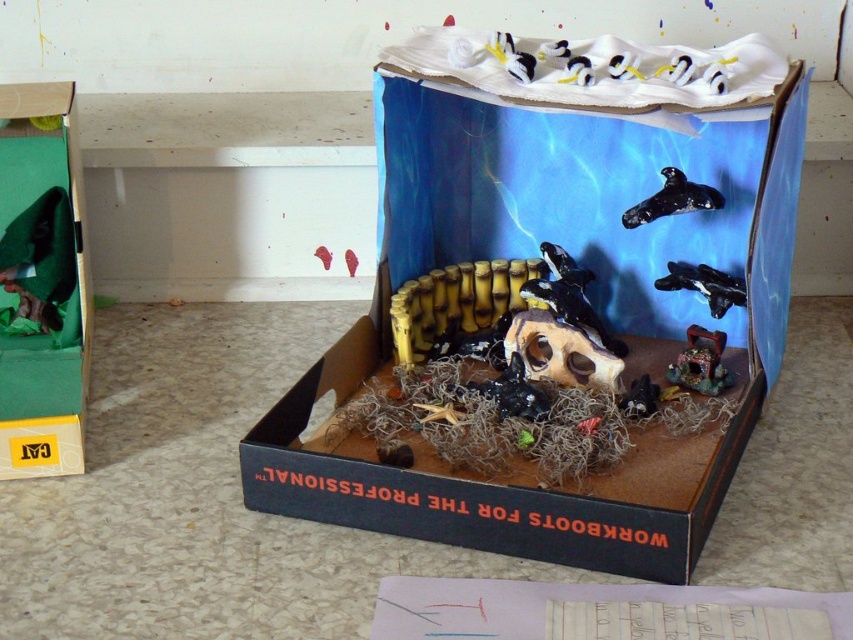
Question: Does green cardboard box at left appear over black glossy skull at center?

Choices:
 (A) no
 (B) yes

Answer: (A)

Question: Which object is the closest to the black glossy skull at center?

Choices:
 (A) black matte orca at upper center
 (B) green cardboard box at left

Answer: (A)

Question: Does black rubber whale at upper center lie in front of black glossy skull at center?

Choices:
 (A) no
 (B) yes

Answer: (B)

Question: Estimate the real-world distances between objects in this image. Which object is closer to the black glossy whale at center?

Choices:
 (A) shiny metallic treasure chest at center
 (B) white fabric at upper center

Answer: (A)

Question: Can you confirm if green cardboard box at left is positioned to the left of black glossy skull at center?

Choices:
 (A) no
 (B) yes

Answer: (B)

Question: Among these points, which one is nearest to the camera?

Choices:
 (A) (508, 52)
 (B) (560, 77)
 (C) (705, 371)

Answer: (B)